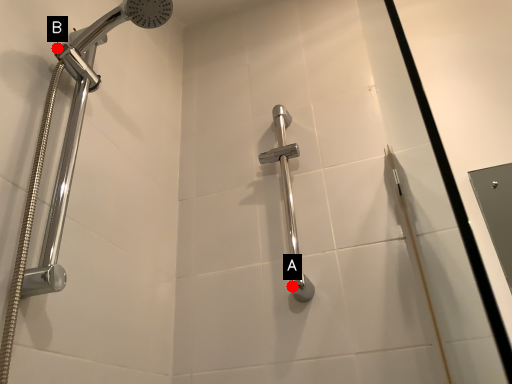
Question: Two points are circled on the image, labeled by A and B beside each circle. Which point is farther to the camera?

Choices:
 (A) A is further
 (B) B is further

Answer: (A)